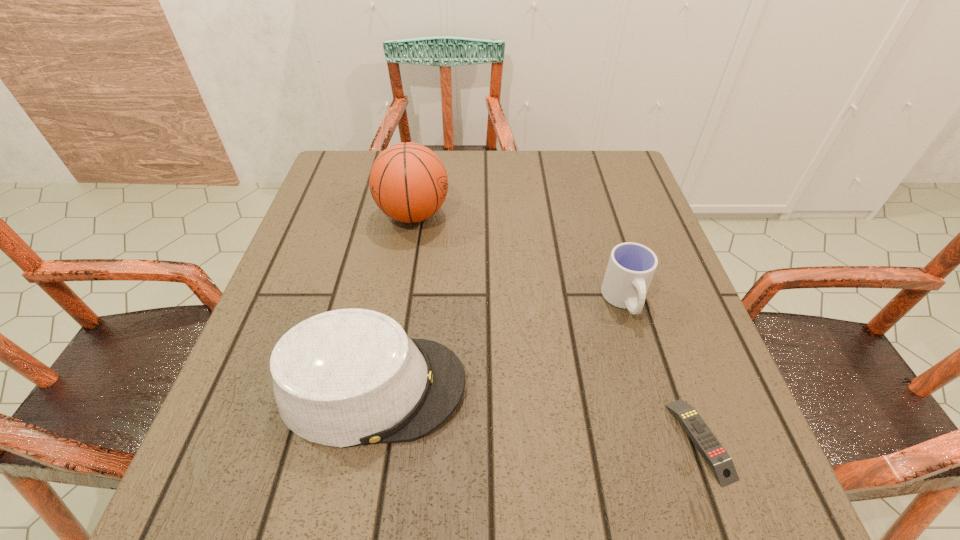
Where is `object present at the near edge`? This screenshot has width=960, height=540. object present at the near edge is located at coordinates (720, 462).

Locate an element on the screen. The image size is (960, 540). basketball located in the left edge section of the desktop is located at coordinates (408, 182).

Locate an element on the screen. This screenshot has width=960, height=540. hat present at the left edge is located at coordinates click(x=347, y=377).

The width and height of the screenshot is (960, 540). What are the coordinates of `cup that is at the right edge` in the screenshot? It's located at (631, 266).

I want to click on remote control that is positioned at the right edge, so click(x=720, y=462).

Where is `object situated at the far left corner`? object situated at the far left corner is located at coordinates [408, 182].

This screenshot has height=540, width=960. Identify the location of object at the near right corner. [x=720, y=462].

Find the location of `free point at the far edge`. free point at the far edge is located at coordinates (552, 172).

I want to click on vacant region at the left edge, so click(x=269, y=303).

Locate an element on the screen. Image resolution: width=960 pixels, height=540 pixels. free location at the right edge of the desktop is located at coordinates (642, 380).